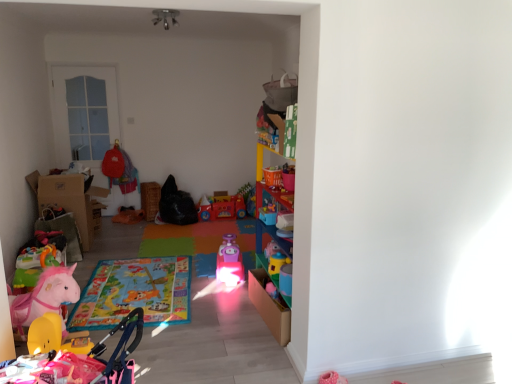
Question: Considering the relative positions of pink plastic toy at center, which is counted as the third toy, starting from the back, and rubber yellow toy at lower left, which is the 1th toy from front to back, in the image provided, is pink plastic toy at center, which is counted as the third toy, starting from the back, to the left of rubber yellow toy at lower left, which is the 1th toy from front to back, from the viewer's perspective?

Choices:
 (A) yes
 (B) no

Answer: (B)

Question: Does pink plastic toy at center, the 4th toy viewed from the front, have a lesser height compared to rubber yellow toy at lower left, which is the 1th toy from front to back?

Choices:
 (A) yes
 (B) no

Answer: (A)

Question: Are pink plastic toy at center, which is counted as the third toy, starting from the back, and rubber yellow toy at lower left, arranged as the 6th toy when viewed from the back, located far from each other?

Choices:
 (A) yes
 (B) no

Answer: (A)

Question: Does pink plastic toy at center, which is counted as the third toy, starting from the back, have a greater height compared to rubber yellow toy at lower left, arranged as the 6th toy when viewed from the back?

Choices:
 (A) no
 (B) yes

Answer: (A)

Question: Is the depth of pink plastic toy at center, the 4th toy viewed from the front, greater than that of rubber yellow toy at lower left, arranged as the 6th toy when viewed from the back?

Choices:
 (A) no
 (B) yes

Answer: (B)

Question: In terms of width, does orange plush toy at center, which is counted as the fifth toy, starting from the front, look wider or thinner when compared to brown cardboard box at left?

Choices:
 (A) thin
 (B) wide

Answer: (A)

Question: Based on their sizes in the image, would you say orange plush toy at center, marked as the 2th toy in a back-to-front arrangement, is bigger or smaller than brown cardboard box at left?

Choices:
 (A) big
 (B) small

Answer: (B)

Question: Choose the correct answer: Is orange plush toy at center, marked as the 2th toy in a back-to-front arrangement, inside brown cardboard box at left or outside it?

Choices:
 (A) outside
 (B) inside

Answer: (A)

Question: Is orange plush toy at center, marked as the 2th toy in a back-to-front arrangement, in front of or behind brown cardboard box at left in the image?

Choices:
 (A) behind
 (B) front

Answer: (A)

Question: Considering the positions of point (148, 243) and point (24, 307), is point (148, 243) closer or farther from the camera than point (24, 307)?

Choices:
 (A) farther
 (B) closer

Answer: (A)

Question: From a real-world perspective, relative to pink plush horse at lower left, the second toy when ordered from front to back, is pink plastic train at center vertically above or below?

Choices:
 (A) above
 (B) below

Answer: (B)

Question: Is pink plastic train at center situated inside pink plush horse at lower left, the second toy when ordered from front to back, or outside?

Choices:
 (A) inside
 (B) outside

Answer: (B)

Question: Is pink plastic train at center wider or thinner than pink plush horse at lower left, which is the fifth toy in back-to-front order?

Choices:
 (A) thin
 (B) wide

Answer: (B)

Question: Would you say pink plastic train at center is inside or outside orange plush toy at center, which is counted as the fifth toy, starting from the front?

Choices:
 (A) inside
 (B) outside

Answer: (B)

Question: From a real-world perspective, is pink plastic train at center above or below orange plush toy at center, marked as the 2th toy in a back-to-front arrangement?

Choices:
 (A) above
 (B) below

Answer: (B)